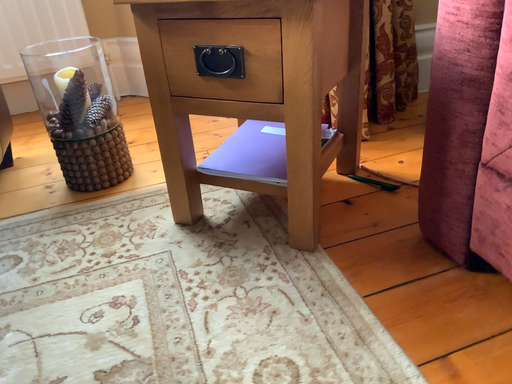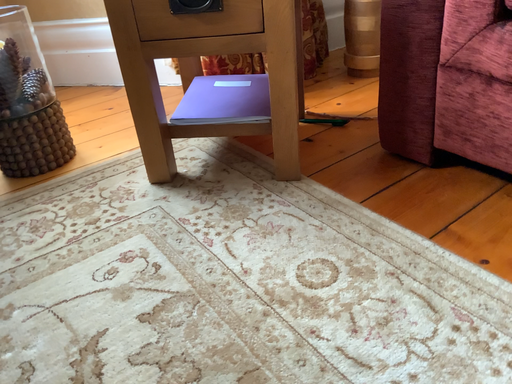
Question: Which way did the camera rotate in the video?

Choices:
 (A) rotated left
 (B) rotated right

Answer: (B)